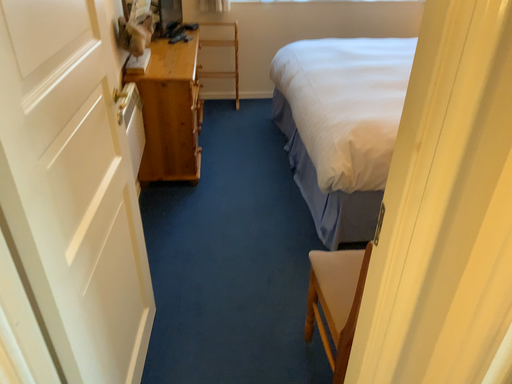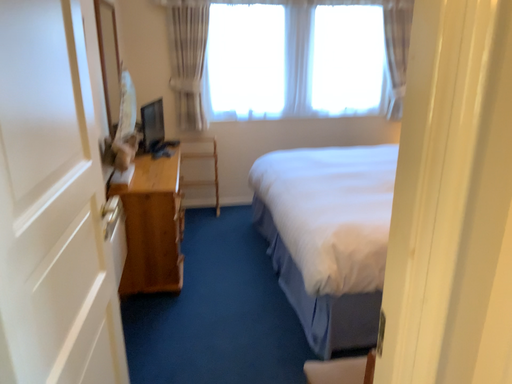
Question: How did the camera likely rotate when shooting the video?

Choices:
 (A) rotated upward
 (B) rotated downward

Answer: (A)